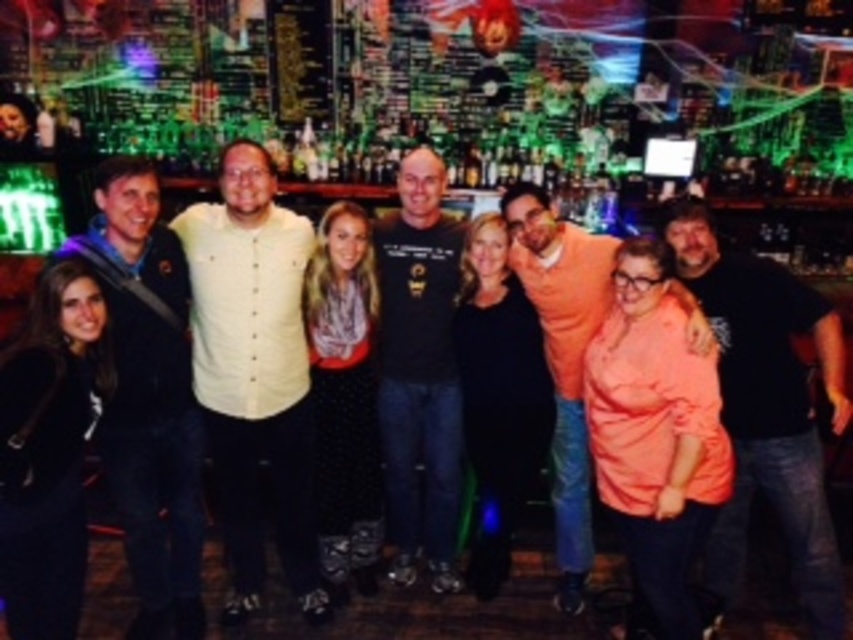
Is light yellow button-up shirt at center to the right of orange cotton shirt at center from the viewer's perspective?

In fact, light yellow button-up shirt at center is to the left of orange cotton shirt at center.

This screenshot has width=853, height=640. Describe the element at coordinates (254, 371) in the screenshot. I see `light yellow button-up shirt at center` at that location.

This screenshot has height=640, width=853. In order to click on light yellow button-up shirt at center in this screenshot , I will do `click(254, 371)`.

Can you confirm if light yellow button-up shirt at center is positioned above dark blue jacket at left?

Correct, light yellow button-up shirt at center is located above dark blue jacket at left.

Which is more to the left, light yellow button-up shirt at center or dark blue jacket at left?

dark blue jacket at left is more to the left.

Is point (193, 388) closer to camera compared to point (109, 429)?

No.

Locate an element on the screen. The width and height of the screenshot is (853, 640). light yellow button-up shirt at center is located at coordinates (254, 371).

Between dark blue jacket at left and orange cotton shirt at center, which one is positioned lower?

orange cotton shirt at center is lower down.

Looking at this image, is dark blue jacket at left below orange cotton shirt at center?

No.

Who is more distant from viewer, (138, 333) or (556, 228)?

Positioned behind is point (556, 228).

The image size is (853, 640). Find the location of `dark blue jacket at left`. dark blue jacket at left is located at coordinates (148, 396).